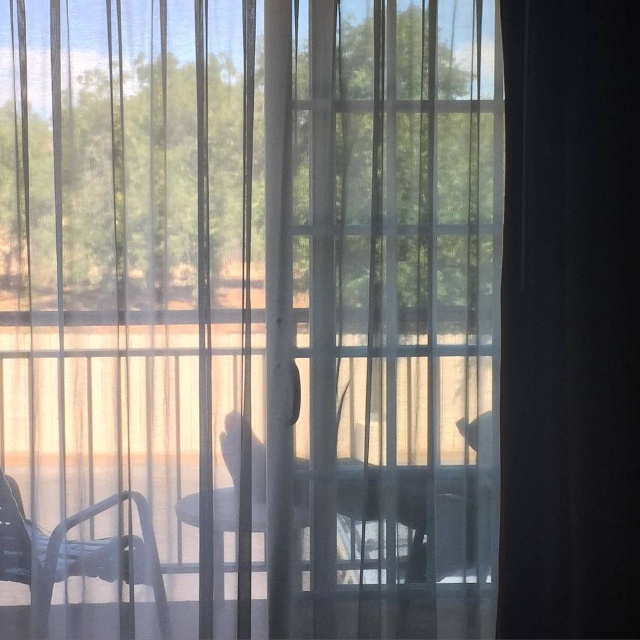
Question: Which object appears closest to the camera in this image?

Choices:
 (A) transparent fabric screen door at center
 (B) metallic silver chair at lower left
 (C) black fabric curtain at right

Answer: (C)

Question: Can you confirm if clear glass table at center is positioned to the left of metallic silver chair at lower left?

Choices:
 (A) no
 (B) yes

Answer: (A)

Question: Is transparent fabric screen door at center further to the viewer compared to black fabric curtain at right?

Choices:
 (A) no
 (B) yes

Answer: (B)

Question: Based on their relative distances, which object is farther from the black fabric curtain at right?

Choices:
 (A) clear glass table at center
 (B) metallic silver chair at lower left
 (C) transparent fabric screen door at center

Answer: (B)

Question: Is transparent fabric screen door at center wider than black fabric curtain at right?

Choices:
 (A) yes
 (B) no

Answer: (A)

Question: Which point is farther to the camera?

Choices:
 (A) (477, 486)
 (B) (51, 557)
 (C) (547, 136)

Answer: (A)